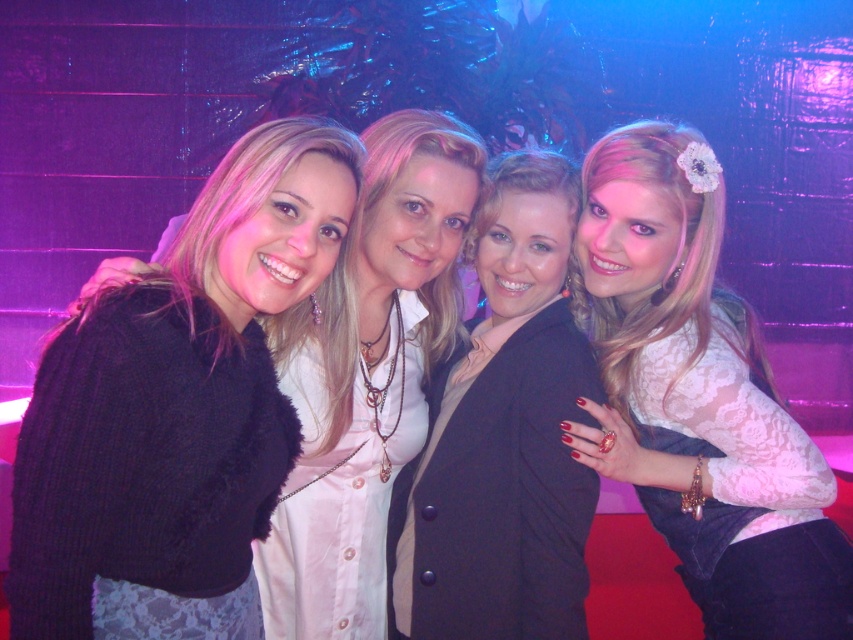
You are a photographer trying to focus on two specific points in the image. The first point is at coordinate point (15, 493) and the second is at point (439, 416). Which of these two points is closer to your camera lens?

Point (15, 493) is closer to the camera than point (439, 416).

You are a photographer adjusting your camera settings to focus on the lace fabric at upper right and the matte black blazer at center. Which object should you focus on first to ensure both are in sharp focus?

The lace fabric at upper right is closer to the viewer than the matte black blazer at center, so you should focus on the lace fabric at upper right first to ensure both are in sharp focus.